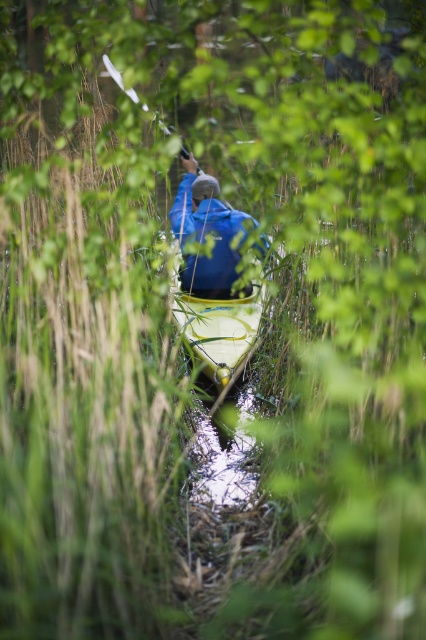
Question: Can you confirm if blue fabric jacket at center is positioned to the left of white plastic paddle at upper center?

Choices:
 (A) yes
 (B) no

Answer: (B)

Question: Is blue fabric jacket at center above yellow matte kayak at center?

Choices:
 (A) no
 (B) yes

Answer: (B)

Question: Which point is farther to the camera?

Choices:
 (A) white plastic paddle at upper center
 (B) blue fabric jacket at center

Answer: (B)

Question: Can you confirm if yellow matte kayak at center is thinner than white plastic paddle at upper center?

Choices:
 (A) no
 (B) yes

Answer: (A)

Question: Which point is farther from the camera taking this photo?

Choices:
 (A) (204, 336)
 (B) (172, 214)
 (C) (104, 56)

Answer: (B)

Question: Which point is farther from the camera taking this photo?

Choices:
 (A) (198, 353)
 (B) (238, 214)
 (C) (109, 65)

Answer: (B)